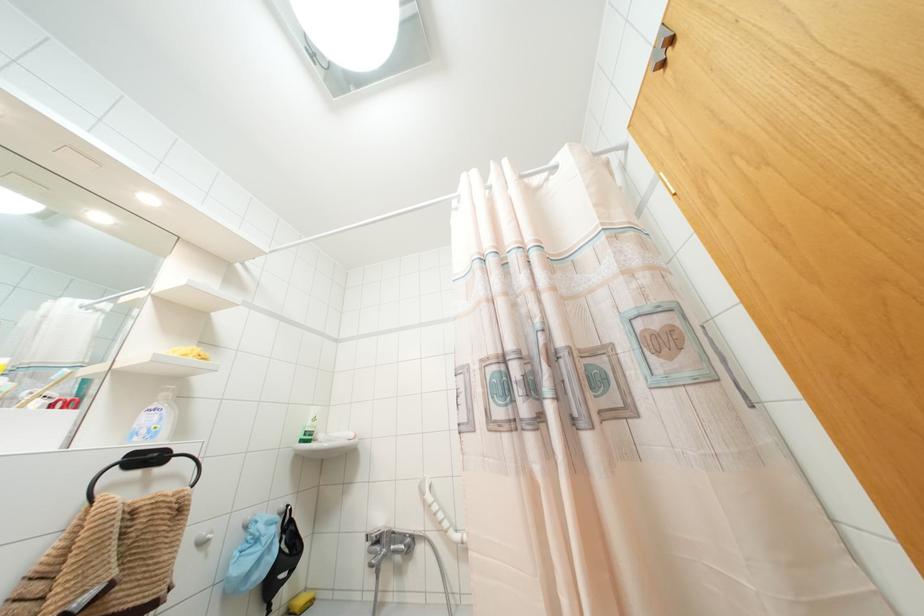
Image resolution: width=924 pixels, height=616 pixels. What do you see at coordinates (310, 427) in the screenshot? I see `the green and white bottle` at bounding box center [310, 427].